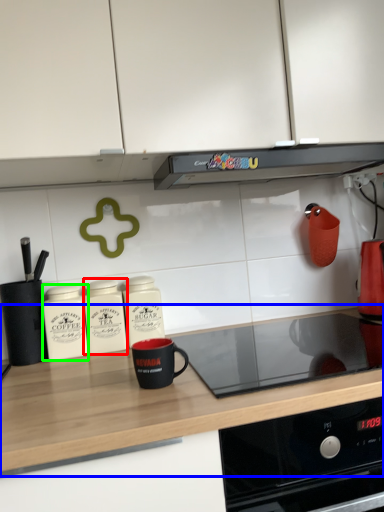
Question: Based on their relative distances, which object is farther from kitchen appliance (highlighted by a red box)? Choose from countertop (highlighted by a blue box) and kitchen appliance (highlighted by a green box).

Choices:
 (A) countertop
 (B) kitchen appliance

Answer: (A)